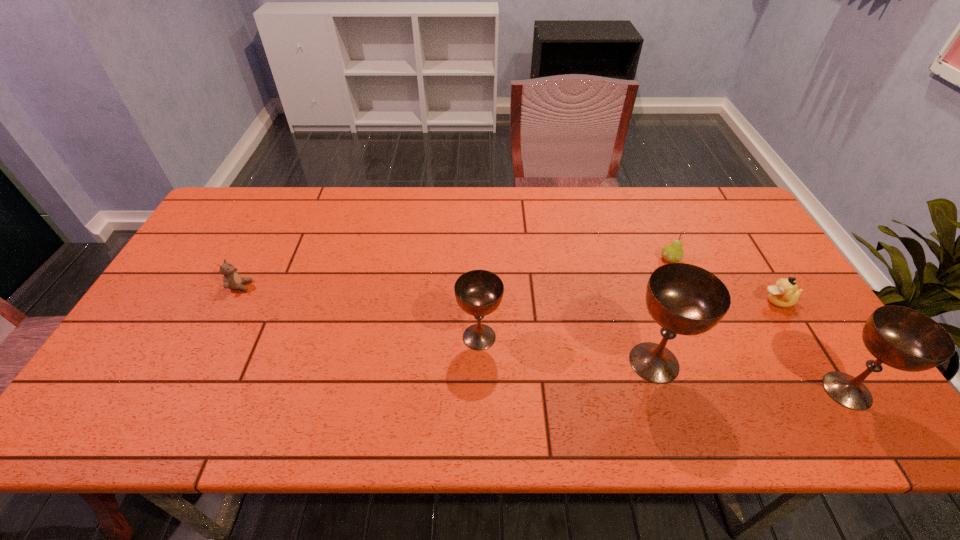
Locate an element on the screen. vacant space at the far edge of the desktop is located at coordinates (556, 195).

The width and height of the screenshot is (960, 540). Find the location of `free space at the near edge`. free space at the near edge is located at coordinates (738, 383).

You are a GUI agent. You are given a task and a screenshot of the screen. Output one action in this format:
    pyautogui.click(x=<x>, y=<y>)
    Task: Click on the vacant area at the left edge of the desktop
    This screenshot has height=540, width=960.
    Given the screenshot: What is the action you would take?
    pyautogui.click(x=229, y=238)

This screenshot has height=540, width=960. Identify the location of vacant space at the right edge. (732, 235).

Locate an element on the screen. free spot at the far left corner of the desktop is located at coordinates (269, 188).

Where is `free space between the teddy bear and the second chalice from left to right`? The height and width of the screenshot is (540, 960). free space between the teddy bear and the second chalice from left to right is located at coordinates (447, 324).

Identify the location of free space between the leftmost object and the second object from left to right. The height and width of the screenshot is (540, 960). (360, 312).

Locate an element on the screen. vacant space in between the leftmost object and the leftmost chalice is located at coordinates (360, 312).

In order to click on vacant space in between the teddy bear and the duckling in this screenshot , I will do [509, 294].

Locate an element on the screen. free spot between the duckling and the second tallest object is located at coordinates (812, 346).